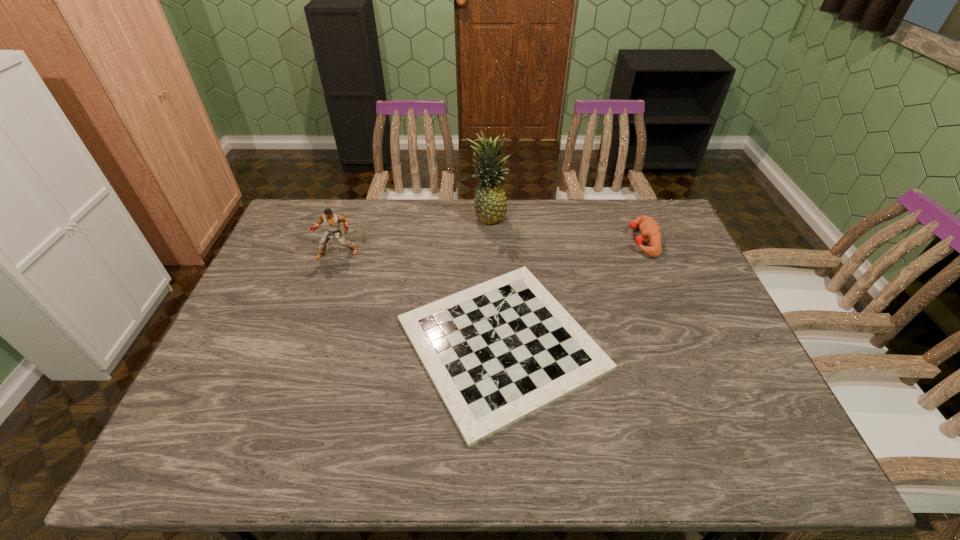
The width and height of the screenshot is (960, 540). In the image, there is a desktop. What are the coordinates of `vacant space at the near edge` in the screenshot? It's located at (696, 458).

In the image, there is a desktop. At what (x,y) coordinates should I click in order to perform the action: click on vacant region at the right edge. Please return your answer as a coordinate pair (x, y). Image resolution: width=960 pixels, height=540 pixels. Looking at the image, I should click on (704, 282).

In the image, there is a desktop. Identify the location of vacant region at the far left corner. (308, 217).

In the image, there is a desktop. Identify the location of free space at the near left corner. This screenshot has width=960, height=540. (241, 448).

Find the location of a particular element. The height and width of the screenshot is (540, 960). vacant region between the nearest object and the third shortest object is located at coordinates (420, 299).

Locate an element on the screen. This screenshot has height=540, width=960. free space between the right puncher and the tallest object is located at coordinates (565, 228).

You are a GUI agent. You are given a task and a screenshot of the screen. Output one action in this format:
    pyautogui.click(x=<x>, y=<y>)
    Task: Click on the free space between the leftmost object and the tallest object
    The width and height of the screenshot is (960, 540).
    Given the screenshot: What is the action you would take?
    pyautogui.click(x=413, y=235)

Image resolution: width=960 pixels, height=540 pixels. I want to click on empty location between the taller puncher and the tallest object, so click(x=413, y=235).

The image size is (960, 540). Identify the location of free point between the tallest object and the taller puncher. (413, 235).

At what (x,y) coordinates should I click in order to perform the action: click on unoccupied position between the shorter puncher and the nearest object. Please return your answer as a coordinate pair (x, y). The width and height of the screenshot is (960, 540). Looking at the image, I should click on click(x=572, y=292).